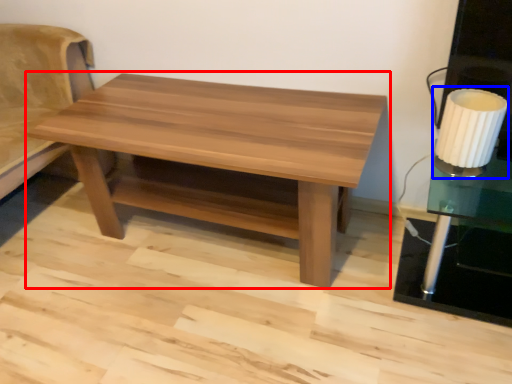
Question: Which object is further to the camera taking this photo, coffee table (highlighted by a red box) or table lamp (highlighted by a blue box)?

Choices:
 (A) coffee table
 (B) table lamp

Answer: (B)